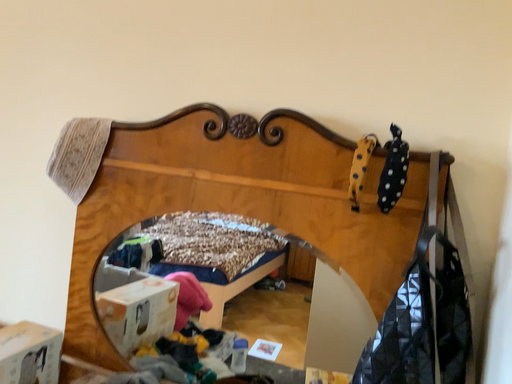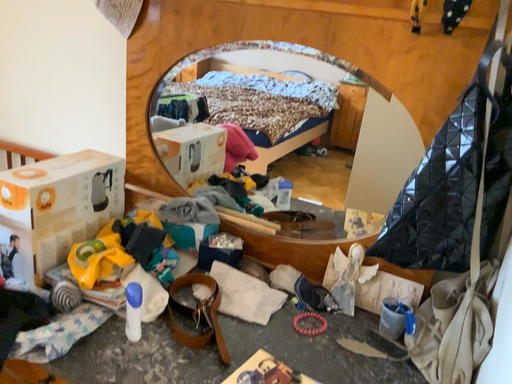
Question: Which way did the camera rotate in the video?

Choices:
 (A) rotated downward
 (B) rotated upward

Answer: (A)